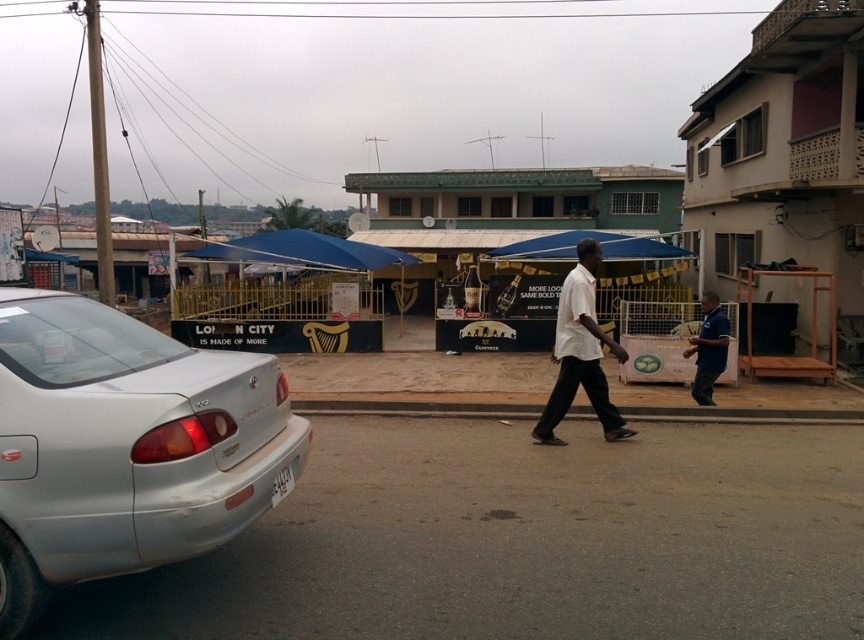
Does silver metallic sedan at left have a lesser height compared to white matte shirt at center?

Correct, silver metallic sedan at left is not as tall as white matte shirt at center.

Does point (143, 536) lie behind point (558, 396)?

No, (143, 536) is closer to viewer.

The height and width of the screenshot is (640, 864). Find the location of `silver metallic sedan at left`. silver metallic sedan at left is located at coordinates (125, 445).

Can you confirm if white matte shirt at center is thinner than dark blue shirt at right?

Incorrect, white matte shirt at center's width is not less than dark blue shirt at right's.

Is white matte shirt at center above dark blue shirt at right?

Yes.

The width and height of the screenshot is (864, 640). What do you see at coordinates (580, 353) in the screenshot? I see `white matte shirt at center` at bounding box center [580, 353].

This screenshot has height=640, width=864. What are the coordinates of `white matte shirt at center` in the screenshot? It's located at (580, 353).

Is silver metallic sedan at left smaller than dark blue shirt at right?

No.

Is silver metallic sedan at left wider than dark blue shirt at right?

Yes.

Where is `silver metallic sedan at left`? silver metallic sedan at left is located at coordinates (125, 445).